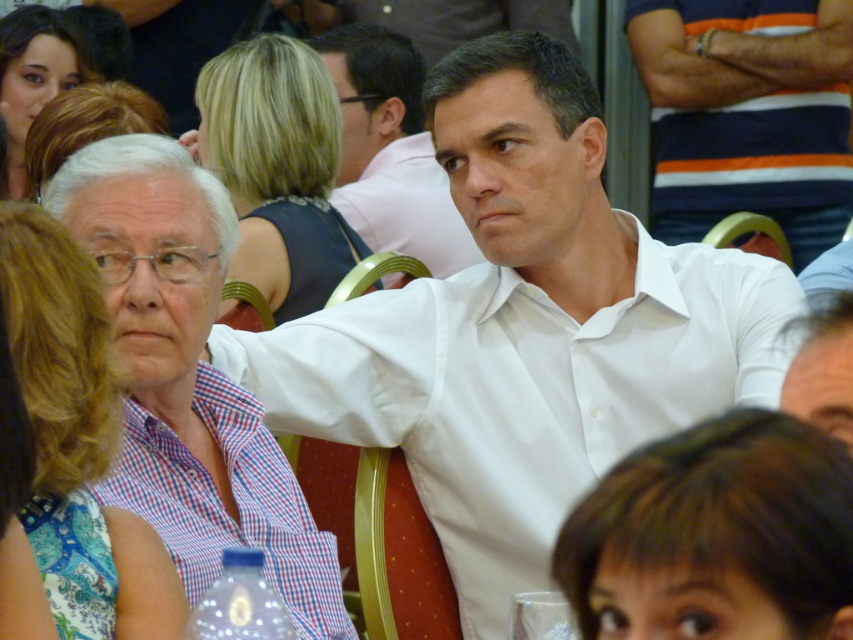
Question: From the image, what is the correct spatial relationship of blue floral dress at left in relation to white shirt at center?

Choices:
 (A) left
 (B) right

Answer: (A)

Question: Is matte black hair at upper left to the left of transparent glass at lower center from the viewer's perspective?

Choices:
 (A) yes
 (B) no

Answer: (A)

Question: Does brown hair at lower right appear over checkered fabric shirt at left?

Choices:
 (A) yes
 (B) no

Answer: (A)

Question: Which of the following is the closest to the observer?

Choices:
 (A) (268, 83)
 (B) (189, 513)
 (C) (74, 83)

Answer: (B)

Question: Which of the following is the closest to the observer?

Choices:
 (A) (83, 227)
 (B) (32, 312)

Answer: (B)

Question: Which object is closer to the camera taking this photo?

Choices:
 (A) matte black hair at upper left
 (B) white cotton shirt at center
 (C) checkered fabric shirt at left

Answer: (C)